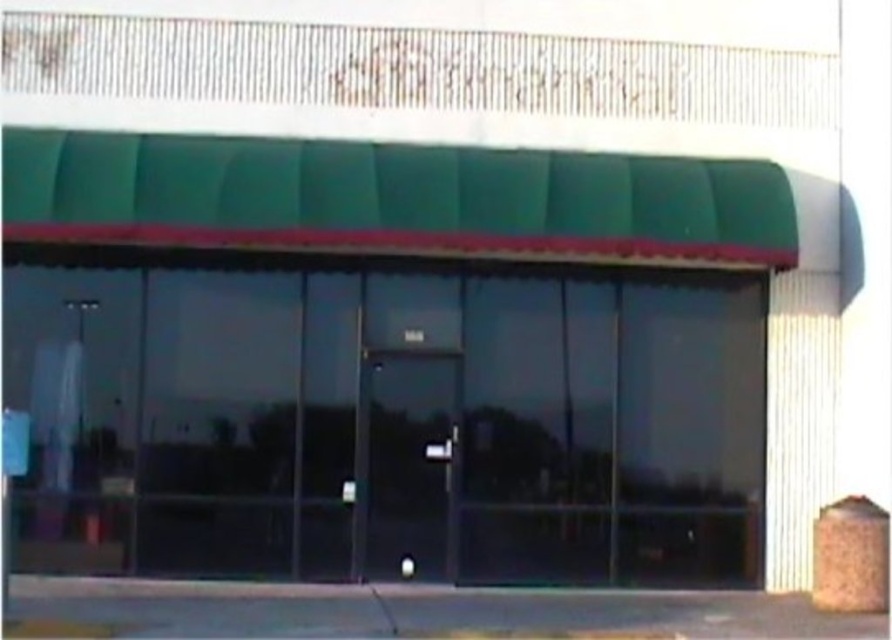
Question: Is transparent glass window at center positioned at the back of transparent glass door at center?

Choices:
 (A) no
 (B) yes

Answer: (A)

Question: Which of the following is the farthest from the observer?

Choices:
 (A) (640, 310)
 (B) (369, 404)

Answer: (A)

Question: Is transparent glass window at center positioned behind transparent glass door at center?

Choices:
 (A) no
 (B) yes

Answer: (A)

Question: Is transparent glass window at center above transparent glass door at center?

Choices:
 (A) yes
 (B) no

Answer: (A)